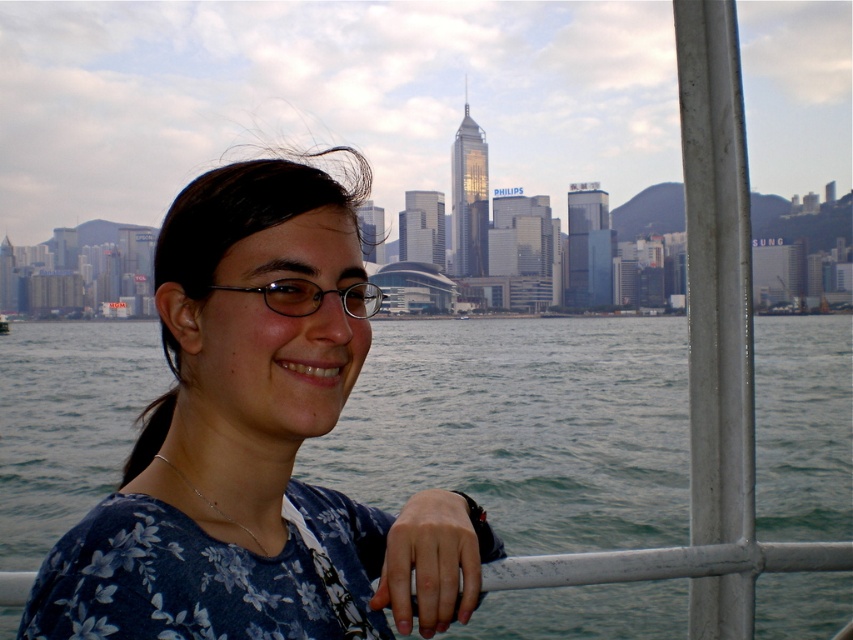
You are a photographer trying to capture a portrait of the person in the scene. You notice the blue floral shirt at center and the clear plastic glasses at center. Which object should you focus on first if you want to ensure both are in sharp focus, considering their sizes?

The blue floral shirt at center is taller than clear plastic glasses at center, so focusing on the blue floral shirt at center first will help ensure both are in sharp focus since it is larger and requires more attention.